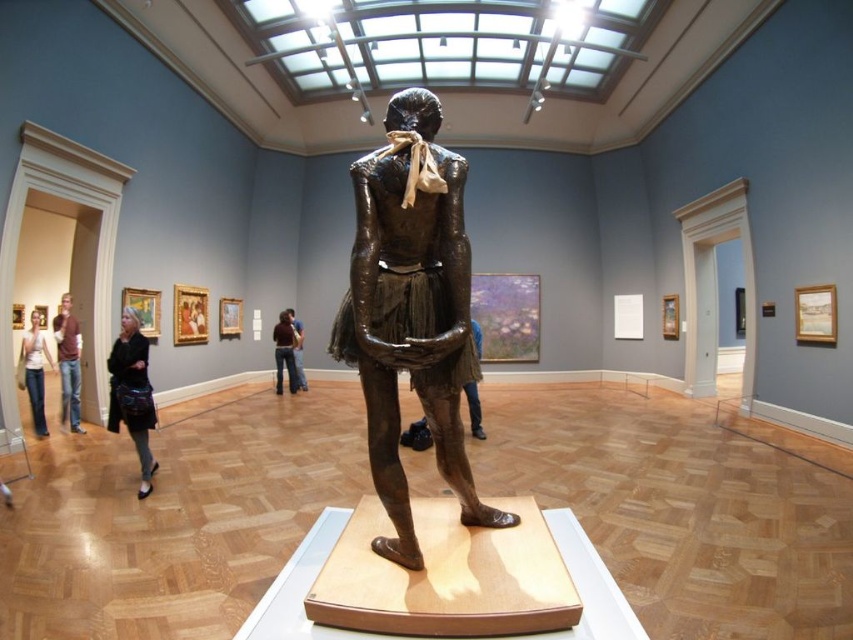
You are a security guard in the museum and need to place a small fire extinguisher between the dark brown leather jacket at lower left and the denim jeans at left. Which object should you position the extinguisher closer to if you want it to be closer to the taller object?

The dark brown leather jacket at lower left is much taller than the denim jeans at left, so you should position the extinguisher closer to the dark brown leather jacket at lower left to be near the taller object.